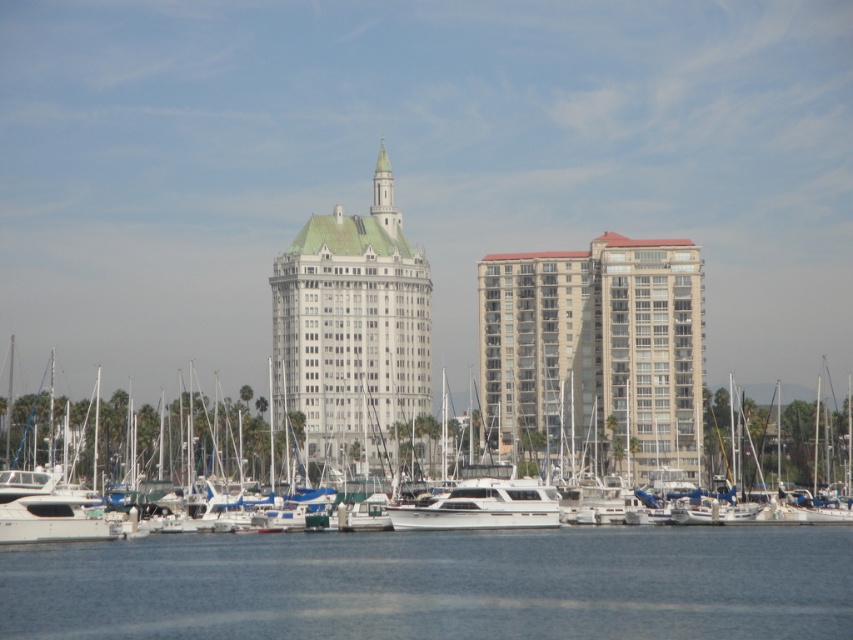
Question: Among these objects, which one is nearest to the camera?

Choices:
 (A) white glossy yacht at center
 (B) clear blue water at lower center
 (C) white glossy boat at center
 (D) white smooth building at center

Answer: (B)

Question: Which point appears farthest from the camera in this image?

Choices:
 (A) (422, 528)
 (B) (607, 413)
 (C) (424, 317)
 (D) (727, 572)

Answer: (C)

Question: Is beige glass building at center in front of white smooth building at center?

Choices:
 (A) yes
 (B) no

Answer: (A)

Question: In this image, where is beige glass building at center located relative to white glossy yacht at center?

Choices:
 (A) above
 (B) below

Answer: (A)

Question: Is clear blue water at lower center further to camera compared to beige glass building at center?

Choices:
 (A) yes
 (B) no

Answer: (B)

Question: Which point is farther from the camera taking this photo?

Choices:
 (A) (80, 433)
 (B) (306, 401)
 (C) (384, 557)

Answer: (A)